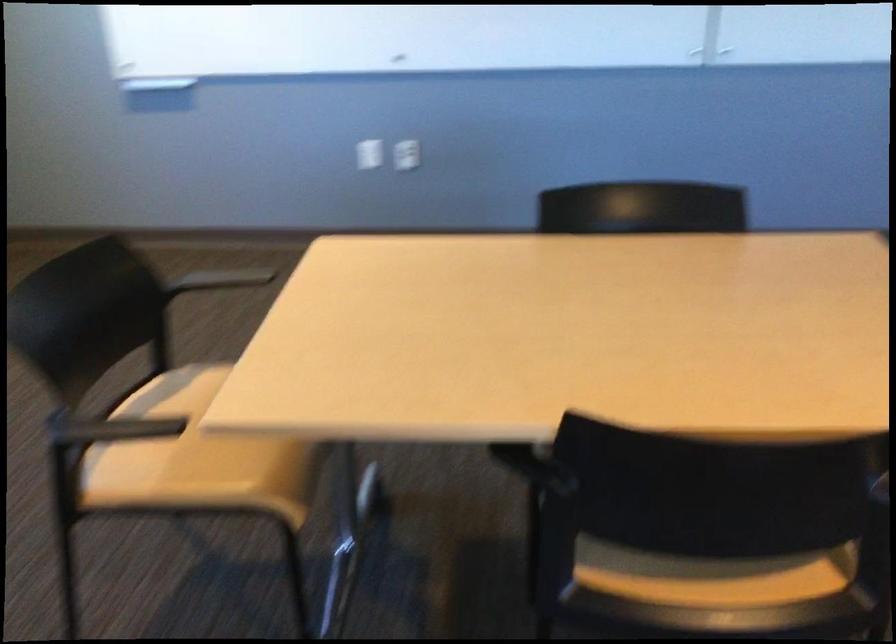
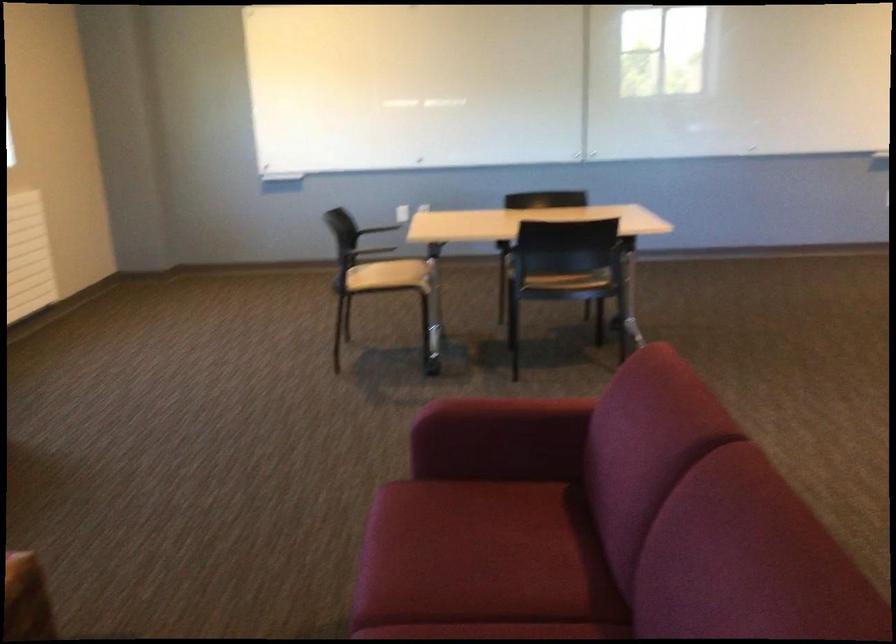
Locate, in the second image, the point that corresponds to point 185,460 in the first image.

(389, 276)